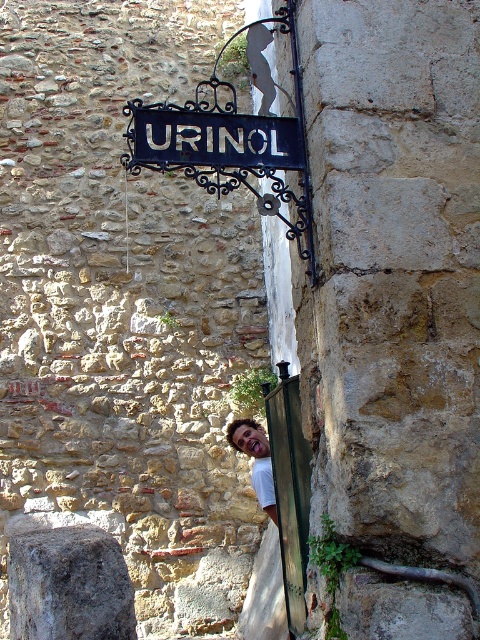
Question: In this image, where is black wrought iron sign at upper center located relative to smooth skin face at lower center?

Choices:
 (A) above
 (B) below

Answer: (A)

Question: Which point is closer to the camera taking this photo?

Choices:
 (A) (254, 432)
 (B) (237, 136)

Answer: (B)

Question: From the image, what is the correct spatial relationship of black wrought iron sign at upper center in relation to smooth skin face at lower center?

Choices:
 (A) right
 (B) left

Answer: (B)

Question: Can you confirm if black wrought iron sign at upper center is bigger than smooth skin face at lower center?

Choices:
 (A) yes
 (B) no

Answer: (B)